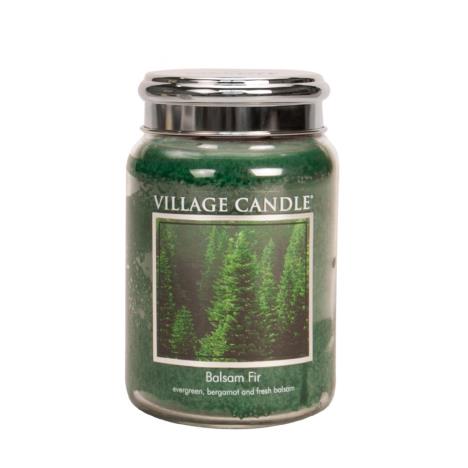
You are a GUI agent. You are given a task and a screenshot of the screen. Output one action in this format:
    pyautogui.click(x=<x>, y=<y>)
    Task: Click on the green candle
    Image resolution: width=468 pixels, height=468 pixels.
    Given the screenshot: What is the action you would take?
    pyautogui.click(x=138, y=311), pyautogui.click(x=149, y=373)